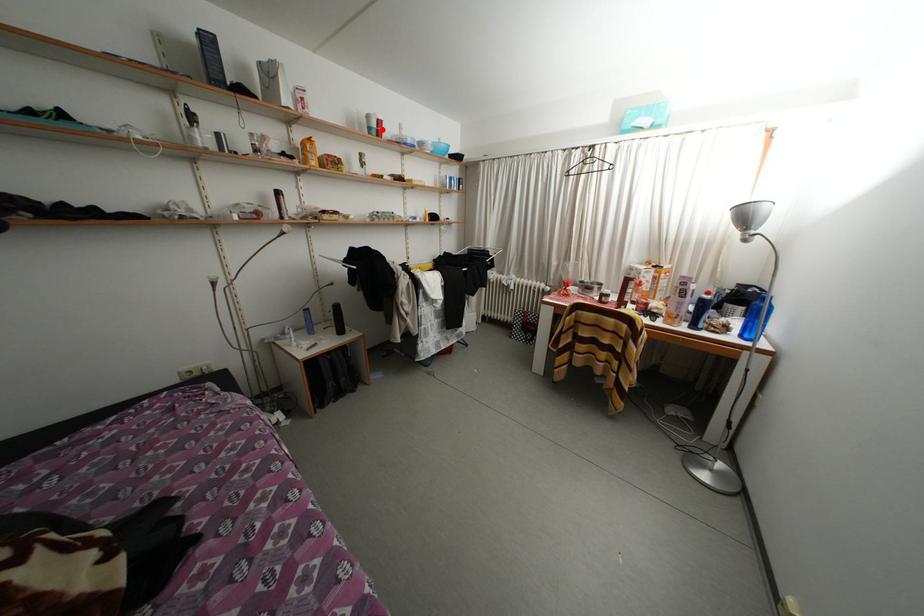
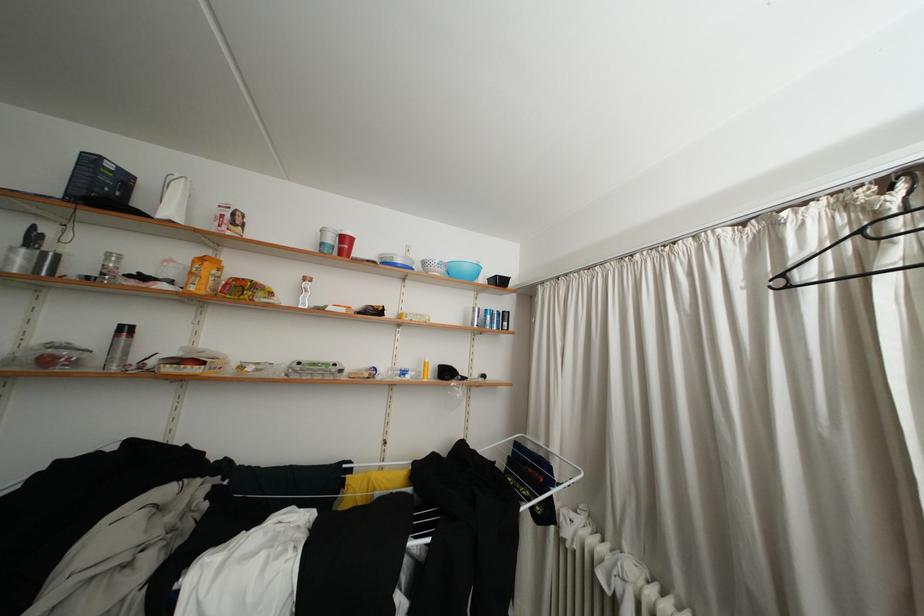
Where in the second image is the point corresponding to the highlighted location from the first image?

(338, 245)